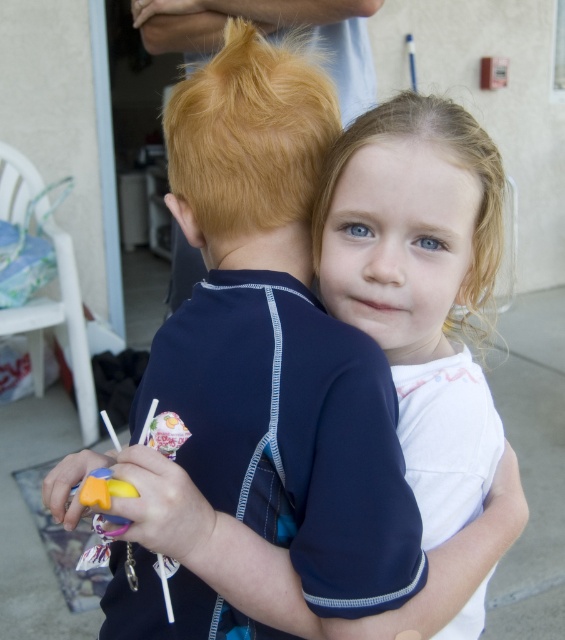
Question: Is dark blue fabric shirt at center above blonde shiny hair at upper center?

Choices:
 (A) yes
 (B) no

Answer: (B)

Question: Is blonde shiny hair at upper center behind blonde curly hair at upper right?

Choices:
 (A) no
 (B) yes

Answer: (B)

Question: Among these objects, which one is nearest to the camera?

Choices:
 (A) blonde curly hair at upper right
 (B) blonde shiny hair at upper center

Answer: (A)

Question: Which of these objects is positioned closest to the blonde curly hair at upper right?

Choices:
 (A) dark blue fabric shirt at center
 (B) blonde shiny hair at upper center

Answer: (B)

Question: Which point is farther to the camera?

Choices:
 (A) (306, 72)
 (B) (137, 388)

Answer: (B)

Question: Does blonde shiny hair at upper center have a greater width compared to blonde curly hair at upper right?

Choices:
 (A) yes
 (B) no

Answer: (B)